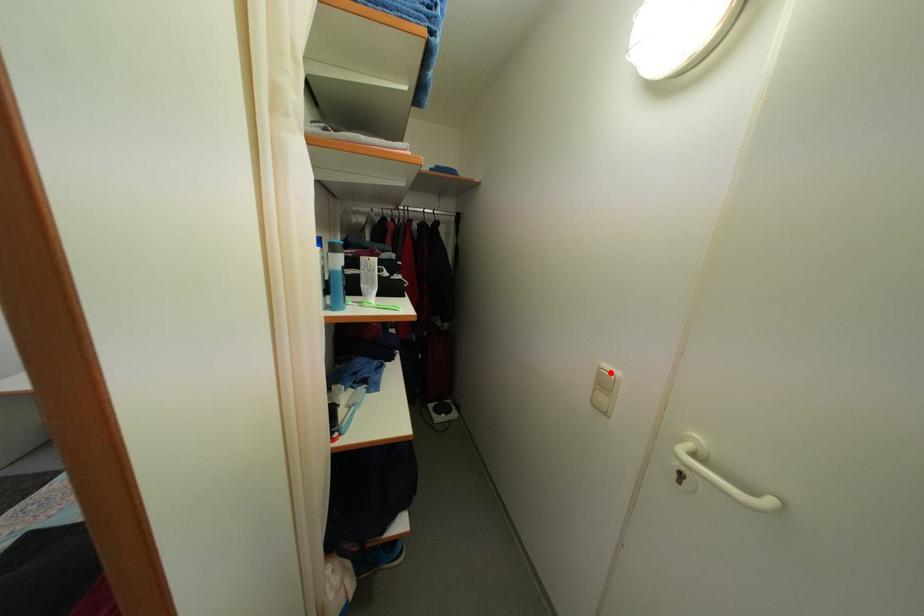
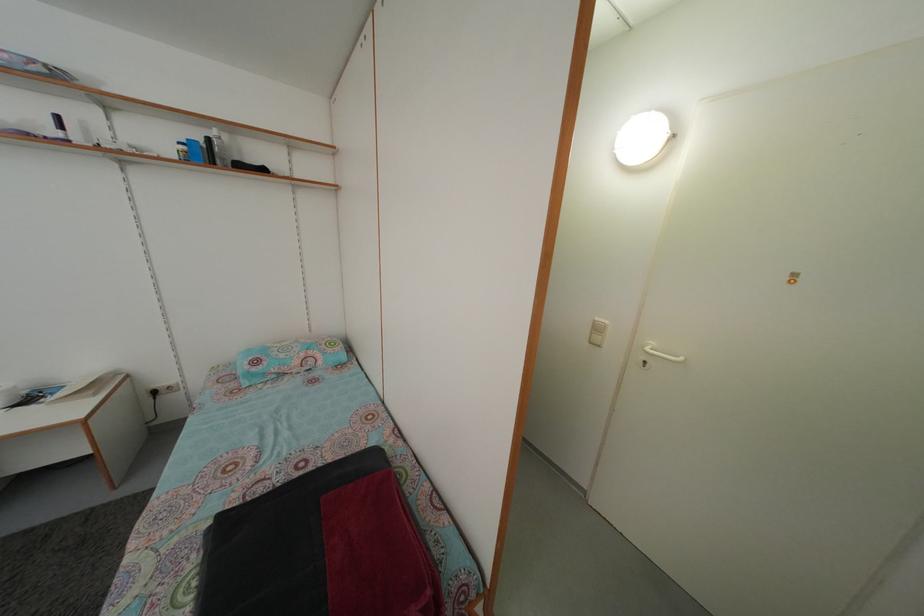
Where in the second image is the point corresponding to the highlighted location from the first image?

(602, 326)